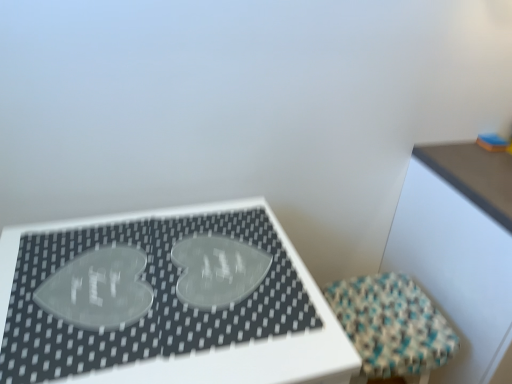
Question: From a real-world perspective, is transparent pet heart at center, marked as the second table in a right-to-left arrangement, beneath textured woven stool at lower right?

Choices:
 (A) no
 (B) yes

Answer: (A)

Question: Can you confirm if transparent pet heart at center, marked as the second table in a right-to-left arrangement, is shorter than textured woven stool at lower right?

Choices:
 (A) yes
 (B) no

Answer: (B)

Question: Does transparent pet heart at center, placed as the 1th table when sorted from left to right, have a lesser width compared to textured woven stool at lower right?

Choices:
 (A) no
 (B) yes

Answer: (A)

Question: From the image's perspective, is transparent pet heart at center, placed as the 1th table when sorted from left to right, on textured woven stool at lower right?

Choices:
 (A) yes
 (B) no

Answer: (A)

Question: From a real-world perspective, is transparent pet heart at center, placed as the 1th table when sorted from left to right, on textured woven stool at lower right?

Choices:
 (A) yes
 (B) no

Answer: (A)

Question: Considering the relative sizes of transparent pet heart at center, marked as the second table in a right-to-left arrangement, and wooden table at upper right, the first table when ordered from right to left, in the image provided, is transparent pet heart at center, marked as the second table in a right-to-left arrangement, smaller than wooden table at upper right, the first table when ordered from right to left,?

Choices:
 (A) no
 (B) yes

Answer: (B)

Question: Are transparent pet heart at center, placed as the 1th table when sorted from left to right, and wooden table at upper right, the 2th table when ordered from left to right, beside each other?

Choices:
 (A) yes
 (B) no

Answer: (B)

Question: From the image's perspective, is transparent pet heart at center, placed as the 1th table when sorted from left to right, located above wooden table at upper right, the 2th table when ordered from left to right?

Choices:
 (A) yes
 (B) no

Answer: (B)

Question: Considering the relative positions of transparent pet heart at center, placed as the 1th table when sorted from left to right, and wooden table at upper right, the first table when ordered from right to left, in the image provided, is transparent pet heart at center, placed as the 1th table when sorted from left to right, to the left of wooden table at upper right, the first table when ordered from right to left, from the viewer's perspective?

Choices:
 (A) yes
 (B) no

Answer: (A)

Question: Is transparent pet heart at center, placed as the 1th table when sorted from left to right, behind wooden table at upper right, the first table when ordered from right to left?

Choices:
 (A) yes
 (B) no

Answer: (B)

Question: Would you say transparent pet heart at center, marked as the second table in a right-to-left arrangement, is outside wooden table at upper right, the 2th table when ordered from left to right?

Choices:
 (A) no
 (B) yes

Answer: (B)

Question: Is wooden table at upper right, the first table when ordered from right to left, at the left side of transparent pet heart at center, placed as the 1th table when sorted from left to right?

Choices:
 (A) yes
 (B) no

Answer: (B)